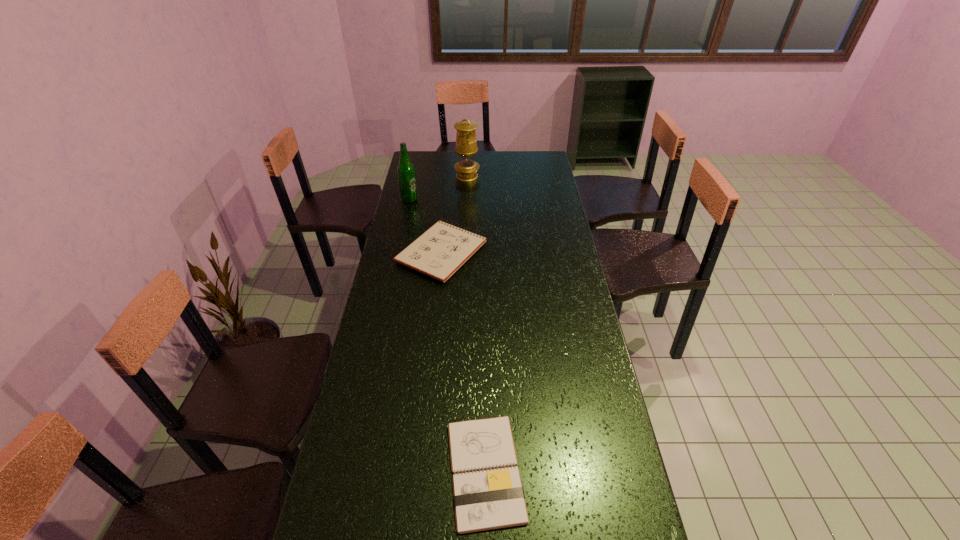
At what (x,y) coordinates should I click in order to perform the action: click on free space in the image that satisfies the following two spatial constraints: 1. on the label of the third nearest object; 2. on the right side of the nearest object. Please return your answer as a coordinate pair (x, y). This screenshot has width=960, height=540. Looking at the image, I should click on (350, 471).

At what (x,y) coordinates should I click in order to perform the action: click on free space that satisfies the following two spatial constraints: 1. on the label of the third nearest object; 2. on the right side of the nearest object. Please return your answer as a coordinate pair (x, y). Looking at the image, I should click on (350, 471).